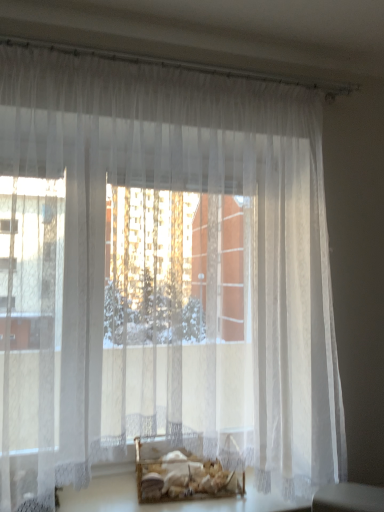
Locate an element on the screen. This screenshot has width=384, height=512. translucent glass table at lower center is located at coordinates (172, 502).

What do you see at coordinates (172, 502) in the screenshot? I see `translucent glass table at lower center` at bounding box center [172, 502].

Image resolution: width=384 pixels, height=512 pixels. Describe the element at coordinates (188, 475) in the screenshot. I see `wooden crate at center` at that location.

Locate an element on the screen. The height and width of the screenshot is (512, 384). wooden crate at center is located at coordinates (188, 475).

You are a GUI agent. You are given a task and a screenshot of the screen. Output one action in this format:
    pyautogui.click(x=<x>, y=<y>)
    Task: Click on the translucent glass table at lower center
    
    Given the screenshot: What is the action you would take?
    pyautogui.click(x=172, y=502)

Does wooden crate at center appear on the left side of translucent glass table at lower center?

Indeed, wooden crate at center is positioned on the left side of translucent glass table at lower center.

Based on the photo, between wooden crate at center and translucent glass table at lower center, which one is positioned in front?

Positioned in front is translucent glass table at lower center.

Which is behind, point (192, 481) or point (303, 501)?

The point (303, 501) is more distant.

From the image's perspective, between wooden crate at center and translucent glass table at lower center, who is located below?

translucent glass table at lower center.

From a real-world perspective, is wooden crate at center positioned above or below translucent glass table at lower center?

wooden crate at center is situated higher than translucent glass table at lower center in the real world.

Which object is thinner, wooden crate at center or translucent glass table at lower center?

Thinner between the two is wooden crate at center.

Is wooden crate at center taller or shorter than translucent glass table at lower center?

In the image, wooden crate at center appears to be taller than translucent glass table at lower center.

Does wooden crate at center have a smaller size compared to translucent glass table at lower center?

Yes.

Would you say wooden crate at center is inside or outside translucent glass table at lower center?

The correct answer is: outside.

Is wooden crate at center in contact with translucent glass table at lower center?

Yes, wooden crate at center is beside translucent glass table at lower center.

Does wooden crate at center turn towards translucent glass table at lower center?

No, wooden crate at center is not aimed at translucent glass table at lower center.

How many degrees apart are the facing directions of wooden crate at center and translucent glass table at lower center?

wooden crate at center and translucent glass table at lower center are facing 7.32 degrees away from each other.

This screenshot has height=512, width=384. I want to click on bed above the translucent glass table at lower center (from a real-world perspective), so click(x=188, y=475).

Is translucent glass table at lower center at the left side of wooden crate at center?

Incorrect, translucent glass table at lower center is not on the left side of wooden crate at center.

Does translucent glass table at lower center come behind wooden crate at center?

No, it is in front of wooden crate at center.

Which is nearer, (253, 508) or (202, 475)?

Point (253, 508)

From the image's perspective, who appears lower, translucent glass table at lower center or wooden crate at center?

translucent glass table at lower center is shown below in the image.

From a real-world perspective, is translucent glass table at lower center positioned under wooden crate at center based on gravity?

Correct, in the physical world, translucent glass table at lower center is lower than wooden crate at center.

Does translucent glass table at lower center have a lesser width compared to wooden crate at center?

Incorrect, the width of translucent glass table at lower center is not less than that of wooden crate at center.

From their relative heights in the image, would you say translucent glass table at lower center is taller or shorter than wooden crate at center?

translucent glass table at lower center is shorter than wooden crate at center.

Looking at the image, does translucent glass table at lower center seem bigger or smaller compared to wooden crate at center?

Clearly, translucent glass table at lower center is larger in size than wooden crate at center.

Is wooden crate at center located within translucent glass table at lower center?

No.

Would you consider translucent glass table at lower center to be distant from wooden crate at center?

No, translucent glass table at lower center is not far from wooden crate at center.

Is translucent glass table at lower center facing away from wooden crate at center?

That's not correct — translucent glass table at lower center is not looking away from wooden crate at center.

What's the angular difference between translucent glass table at lower center and wooden crate at center's facing directions?

7.32 degrees separate the facing orientations of translucent glass table at lower center and wooden crate at center.

Image resolution: width=384 pixels, height=512 pixels. What are the coordinates of `table that is under the wooden crate at center (from a real-world perspective)` in the screenshot? It's located at (172, 502).

The width and height of the screenshot is (384, 512). I want to click on table directly beneath the wooden crate at center (from a real-world perspective), so point(172,502).

Identify the location of bed above the translucent glass table at lower center (from the image's perspective). Image resolution: width=384 pixels, height=512 pixels. tap(188, 475).